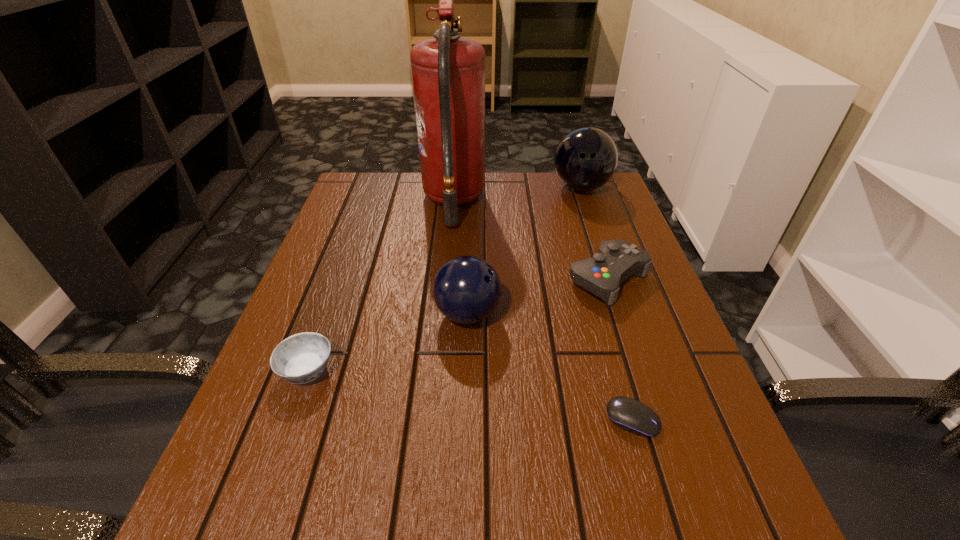
Where is `free point located at the front of the tallest object where the nozzle is aimed`? free point located at the front of the tallest object where the nozzle is aimed is located at coordinates (578, 201).

At what (x,y) coordinates should I click in order to perform the action: click on vacant space located on the side of the right bowling ball with the finger holes. Please return your answer as a coordinate pair (x, y). Looking at the image, I should click on (x=615, y=289).

This screenshot has height=540, width=960. In order to click on vacant region located 0.290m on the surface of the shorter bowling ball near the finger holes in this screenshot , I will do `click(643, 314)`.

Where is `vacant space located on the back of the fourth tallest object`? The image size is (960, 540). vacant space located on the back of the fourth tallest object is located at coordinates (591, 227).

Locate an element on the screen. free space located on the back of the fifth tallest object is located at coordinates (323, 328).

What are the coordinates of `free space located 0.330m on the back of the shortest object` in the screenshot? It's located at (590, 274).

Identify the location of fire extinguisher present at the far edge. This screenshot has height=540, width=960. (448, 72).

You are a GUI agent. You are given a task and a screenshot of the screen. Output one action in this format:
    pyautogui.click(x=<x>, y=<y>)
    Task: Click on the bowling ball that is at the far edge
    Image resolution: width=960 pixels, height=540 pixels.
    Given the screenshot: What is the action you would take?
    pyautogui.click(x=585, y=159)

Where is `object that is at the left edge`? object that is at the left edge is located at coordinates (301, 358).

In order to click on bowling ball at the right edge in this screenshot , I will do `click(585, 159)`.